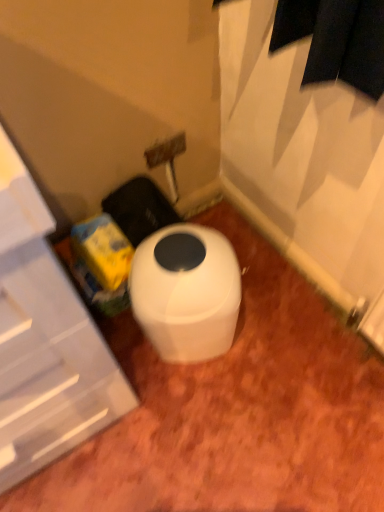
Locate an element on the screen. unoccupied region to the right of white glossy toilet at center is located at coordinates (274, 326).